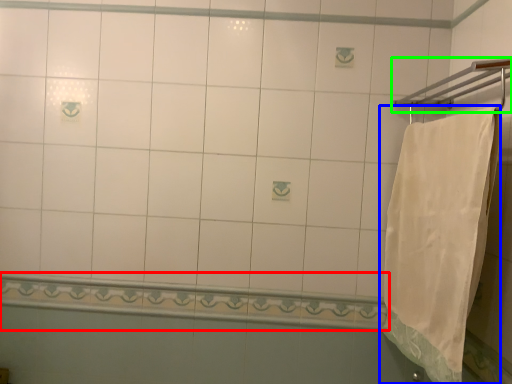
Question: Which object is positioned closest to balustrade (highlighted by a red box)? Select from towel (highlighted by a blue box) and towel bar (highlighted by a green box).

Choices:
 (A) towel
 (B) towel bar

Answer: (A)